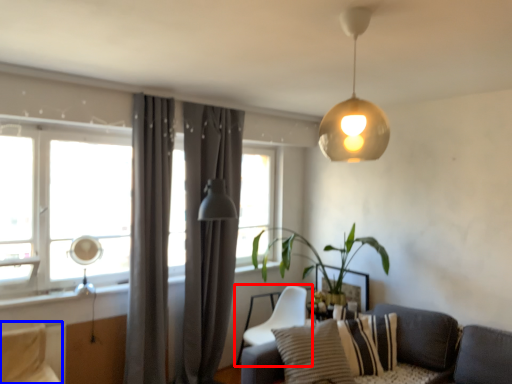
Question: Which object is further to the camera taking this photo, chair (highlighted by a red box) or swivel chair (highlighted by a blue box)?

Choices:
 (A) chair
 (B) swivel chair

Answer: (A)